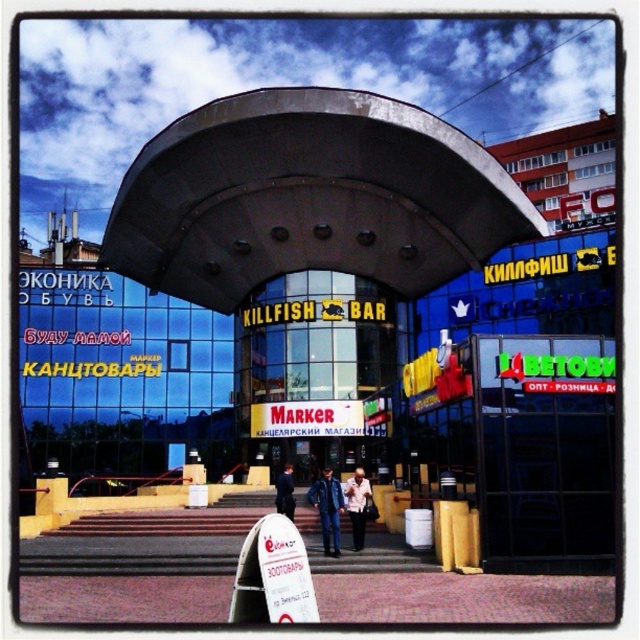
What is the position of the blue denim jacket at center relative to the light brown leather jacket at center?

The blue denim jacket at center is positioned below the light brown leather jacket at center.